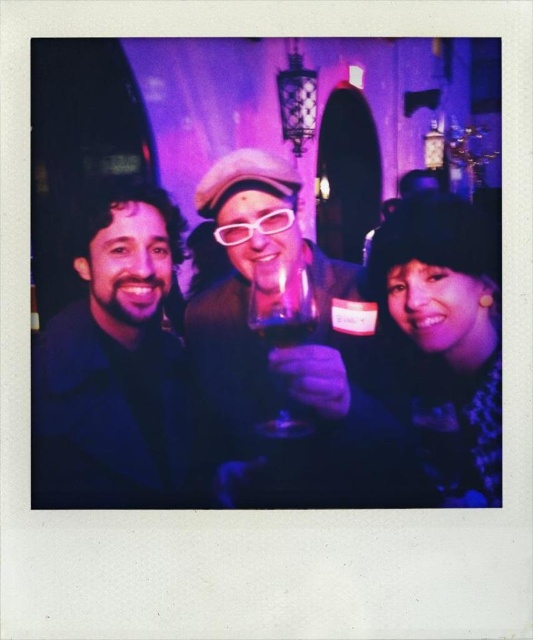
Who is positioned more to the right, matte plastic wine glass at center or transparent glass at center?

transparent glass at center is more to the right.

Who is more distant from viewer, (227, 387) or (276, 401)?

Point (227, 387)

Is point (314, 404) behind point (265, 436)?

Yes, it is behind point (265, 436).

Locate an element on the screen. The width and height of the screenshot is (533, 640). matte plastic wine glass at center is located at coordinates (286, 355).

Can you confirm if matte black jacket at left is wider than velvet black hat at right?

Yes, matte black jacket at left is wider than velvet black hat at right.

Which is in front, point (155, 461) or point (457, 289)?

Positioned in front is point (457, 289).

I want to click on matte black jacket at left, so click(119, 365).

Does matte plastic wine glass at center have a greater height compared to velvet black hat at right?

Correct, matte plastic wine glass at center is much taller as velvet black hat at right.

Based on the photo, who is positioned more to the left, matte plastic wine glass at center or velvet black hat at right?

matte plastic wine glass at center

Does point (228, 196) lie in front of point (481, 474)?

No, it is behind (481, 474).

Identify the location of matte plastic wine glass at center. This screenshot has height=640, width=533. (286, 355).